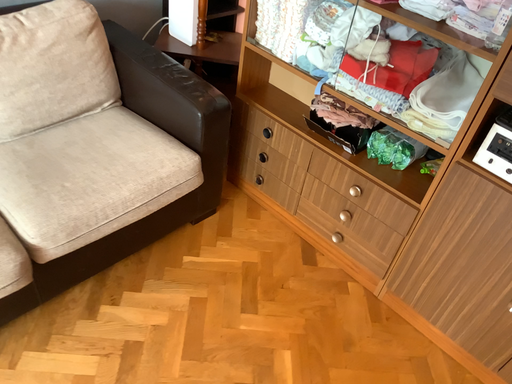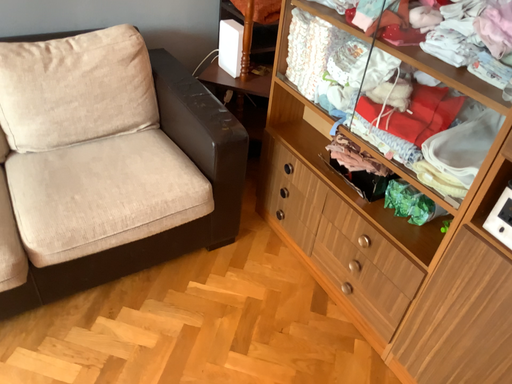
Question: How did the camera likely rotate when shooting the video?

Choices:
 (A) rotated right
 (B) rotated left

Answer: (B)